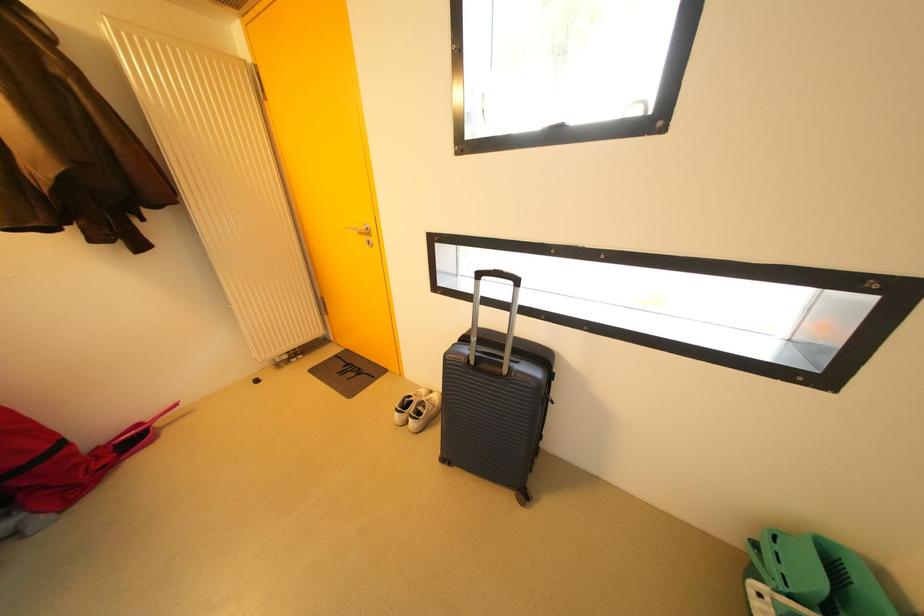
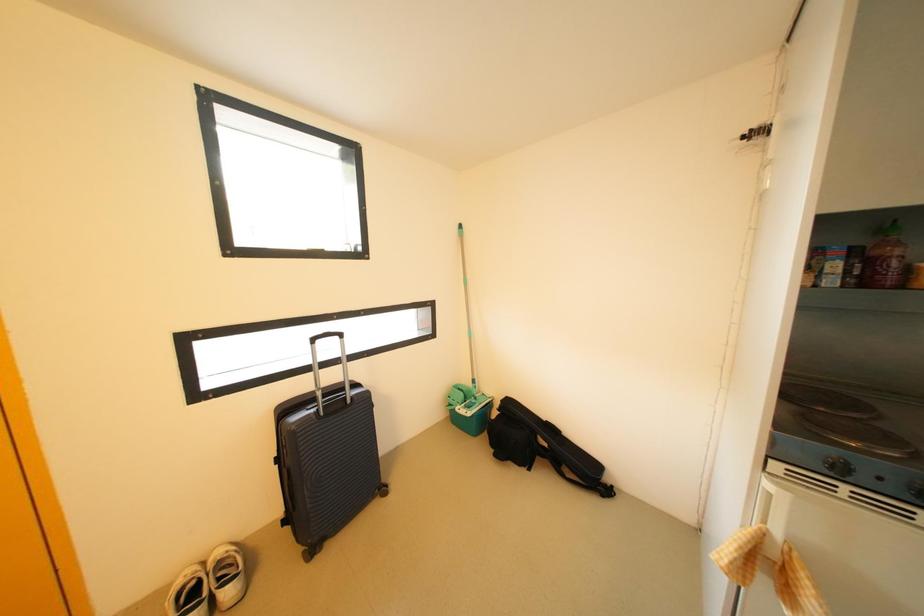
Question: Based on the continuous images, in which direction is the camera rotating? Reply with the corresponding letter.

Choices:
 (A) Left
 (B) Right
 (C) Up
 (D) Down

Answer: (B)